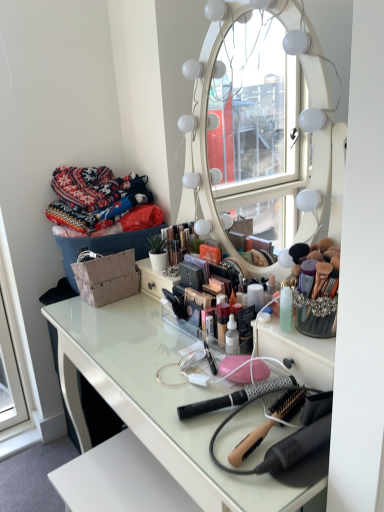
You are a GUI agent. You are given a task and a screenshot of the screen. Output one action in this format:
    pyautogui.click(x=<x>, y=<y>)
    Task: Click on the vacant area to the left of black plastic brush at center, the 1th brush when ordered from back to front
    This screenshot has width=384, height=512.
    Given the screenshot: What is the action you would take?
    pyautogui.click(x=167, y=394)